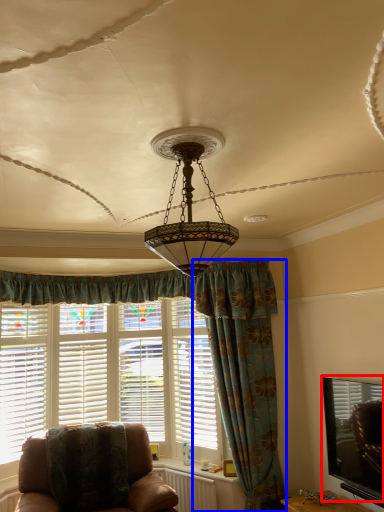
Question: Among these objects, which one is farthest to the camera, window screen (highlighted by a red box) or curtain (highlighted by a blue box)?

Choices:
 (A) window screen
 (B) curtain

Answer: (B)